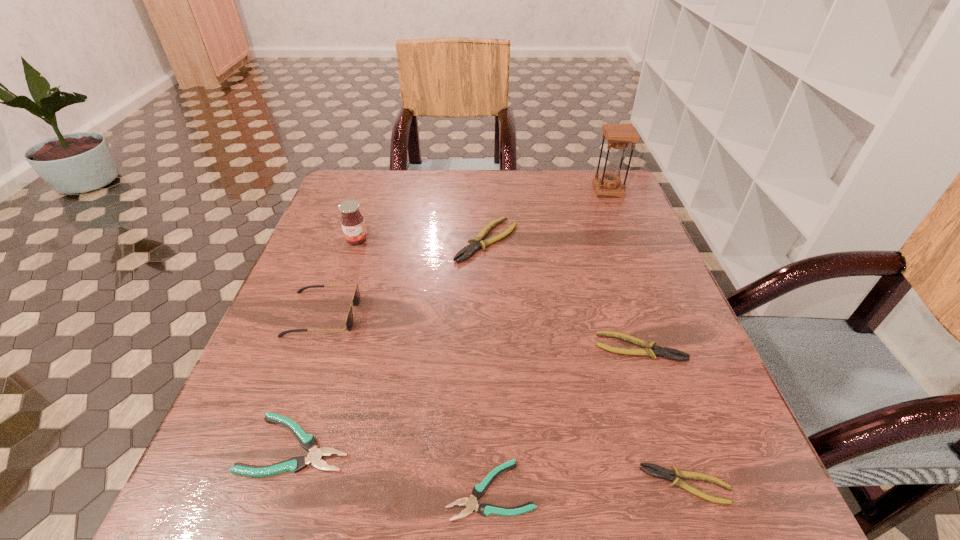
Where is `the bigger teal pliers`? This screenshot has height=540, width=960. the bigger teal pliers is located at coordinates (308, 442).

Find the location of `the smallest yellow pliers`. the smallest yellow pliers is located at coordinates (662, 473).

Identify the location of the right teal pliers. The height and width of the screenshot is (540, 960). (485, 509).

Where is `the shortest object`? This screenshot has height=540, width=960. the shortest object is located at coordinates (485, 509).

This screenshot has width=960, height=540. In order to click on free location located on the left of the farthest object in this screenshot , I will do `click(538, 191)`.

Where is `vacant space situated on the label side of the jam`? vacant space situated on the label side of the jam is located at coordinates (312, 370).

Locate an element on the screen. This screenshot has width=960, height=540. free location located on the front-facing side of the third tallest object is located at coordinates (460, 315).

Where is `vacant space located on the front of the leftmost yellow pliers`? This screenshot has height=540, width=960. vacant space located on the front of the leftmost yellow pliers is located at coordinates click(488, 319).

Find the location of a particular element. free space located 0.280m on the left of the second tallest pliers is located at coordinates (446, 347).

Identify the location of vacant space located 0.340m on the right of the leftmost pliers. This screenshot has width=960, height=540. (568, 444).